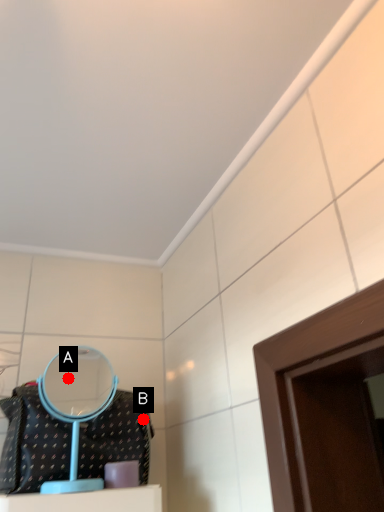
Question: Two points are circled on the image, labeled by A and B beside each circle. Which point appears farthest from the camera in this image?

Choices:
 (A) A is further
 (B) B is further

Answer: (A)